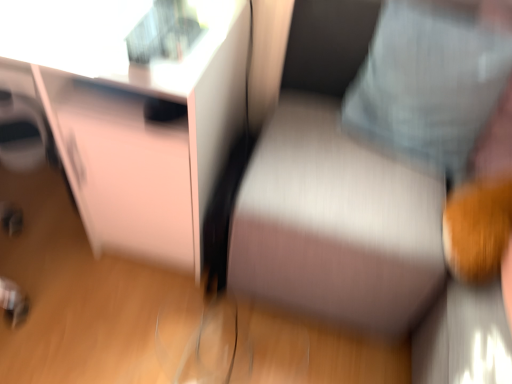
Describe the element at coordinates (136, 115) in the screenshot. The height and width of the screenshot is (384, 512). I see `matte white computer desk at left` at that location.

You are a GUI agent. You are given a task and a screenshot of the screen. Output one action in this format:
    pyautogui.click(x=<x>, y=<y>)
    Task: Click on the matte white computer desk at left
    
    Given the screenshot: What is the action you would take?
    pyautogui.click(x=136, y=115)

The image size is (512, 384). What are the coordinates of `matte white computer desk at left` in the screenshot? It's located at (136, 115).